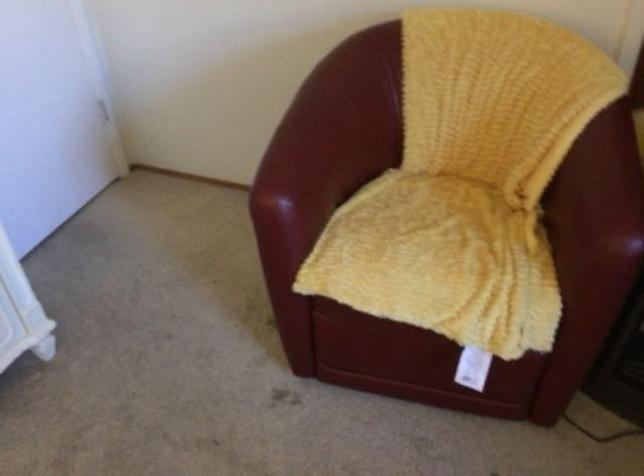
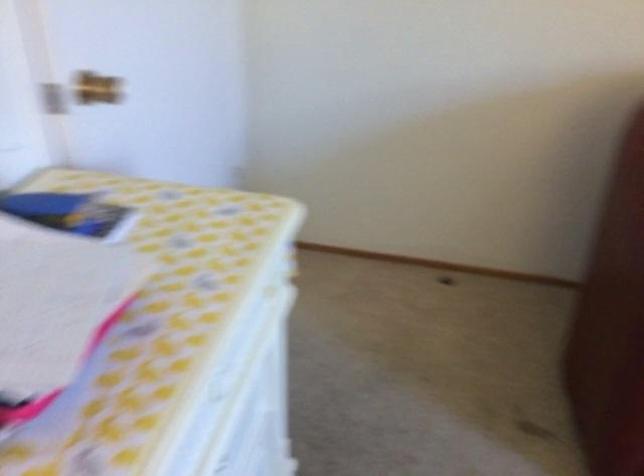
Question: Based on the continuous images, in which direction is the camera rotating? Reply with the corresponding letter.

Choices:
 (A) Left
 (B) Right
 (C) Up
 (D) Down

Answer: (B)